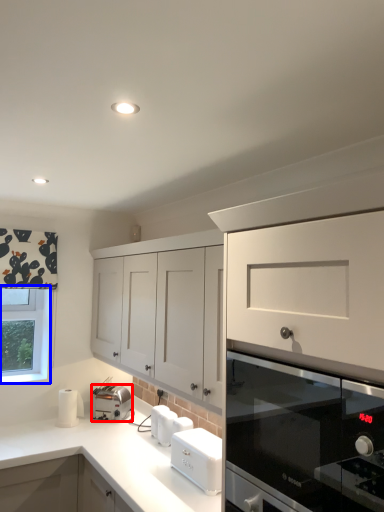
Question: Among these objects, which one is nearest to the camera, kitchen appliance (highlighted by a red box) or window (highlighted by a blue box)?

Choices:
 (A) kitchen appliance
 (B) window

Answer: (A)